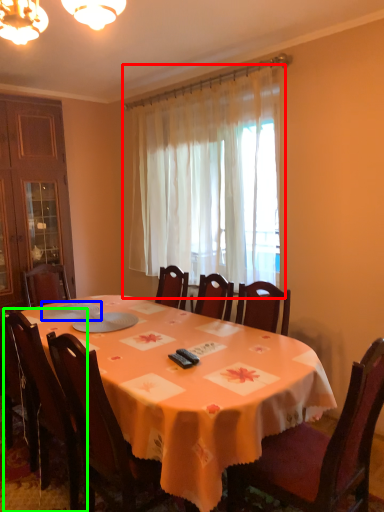
Question: Estimate the real-world distances between objects in this image. Which object is closer to curtain (highlighted by a red box), tableware (highlighted by a blue box) or chair (highlighted by a green box)?

Choices:
 (A) tableware
 (B) chair

Answer: (A)